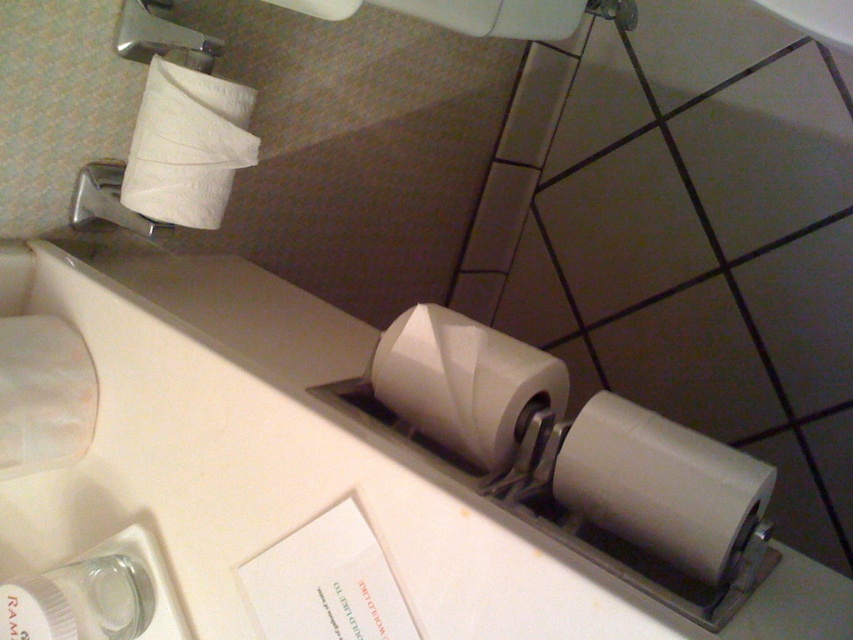
Question: Based on their relative distances, which object is farther from the white matte counter top at center?

Choices:
 (A) white matte toilet paper at upper left
 (B) white matte toilet paper at center

Answer: (A)

Question: Which object is closer to the camera taking this photo?

Choices:
 (A) white matte toilet paper at center
 (B) white matte counter top at center
 (C) white matte toilet paper at upper left
 (D) white matte toilet paper at lower center

Answer: (B)

Question: Considering the relative positions of white matte counter top at center and white matte toilet paper at upper left in the image provided, where is white matte counter top at center located with respect to white matte toilet paper at upper left?

Choices:
 (A) left
 (B) right

Answer: (B)

Question: Is white matte counter top at center to the right of white matte toilet paper at upper left from the viewer's perspective?

Choices:
 (A) no
 (B) yes

Answer: (B)

Question: Is white matte toilet paper at lower center smaller than white matte toilet paper at upper left?

Choices:
 (A) no
 (B) yes

Answer: (A)

Question: Among these objects, which one is nearest to the camera?

Choices:
 (A) white matte toilet paper at center
 (B) white matte toilet paper at lower left
 (C) white matte counter top at center
 (D) white matte toilet paper at lower center

Answer: (C)